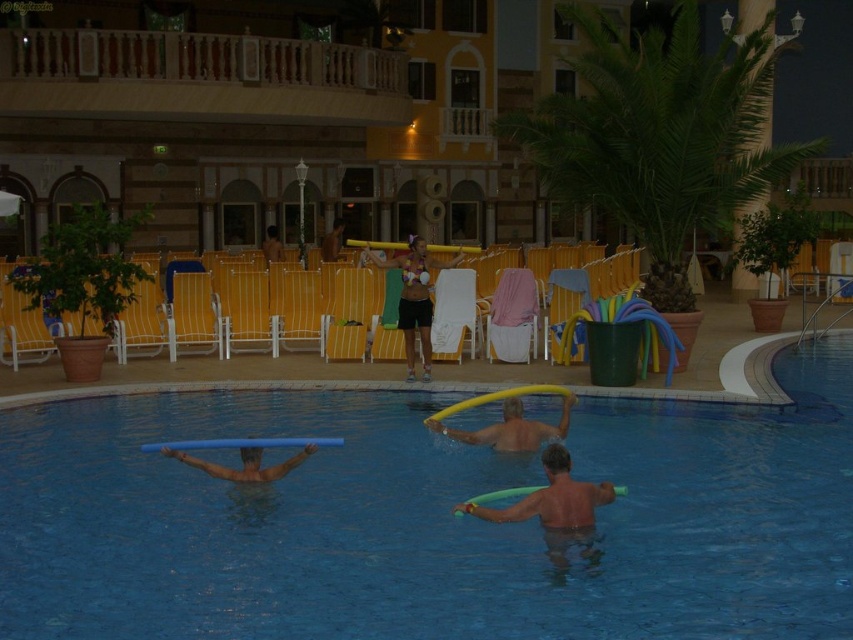
You are a photographer positioned at the edge of the pool. You want to take a photo that includes both the yellow foam at upper center and the matte black bikini at center. Which object will appear larger in the photo?

The yellow foam at upper center will appear larger in the photo because it is closer to the viewer than the matte black bikini at center.